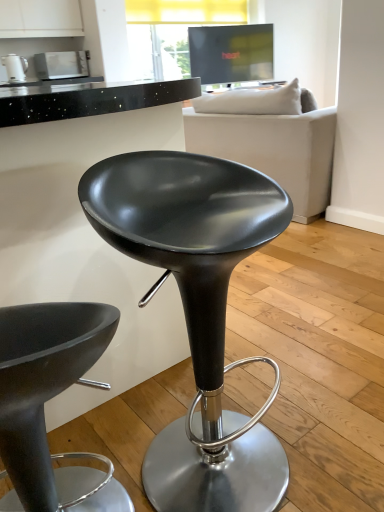
This screenshot has width=384, height=512. Identify the location of matte white kettle at upper left, positioned as the 1th appliance in front-to-back order. (15, 67).

Image resolution: width=384 pixels, height=512 pixels. In order to click on matte white microwave at upper left, the second appliance when ordered from left to right in this screenshot , I will do `click(61, 65)`.

Where is `matte white kettle at upper left, acting as the second appliance starting from the back`? The image size is (384, 512). matte white kettle at upper left, acting as the second appliance starting from the back is located at coordinates 15,67.

From the image's perspective, which object appears higher, white fabric couch at upper center or matte black stool at center, the second chair in the left-to-right sequence?

white fabric couch at upper center.

In the scene shown: What's the angular difference between white fabric couch at upper center and matte black stool at center, placed as the 1th chair when sorted from right to left,'s facing directions?

They differ by 68 degrees in their facing directions.

Does point (282, 118) appear closer or farther from the camera than point (161, 239)?

Point (282, 118) is farther from the camera than point (161, 239).

Is white fabric couch at upper center touching matte black stool at center, placed as the 1th chair when sorted from right to left?

No, white fabric couch at upper center is not next to matte black stool at center, placed as the 1th chair when sorted from right to left.

This screenshot has width=384, height=512. In order to click on chair on the left of the matte black stool at center, placed as the 1th chair when sorted from right to left in this screenshot , I will do `click(49, 399)`.

Who is smaller, matte black stool at center, the second chair in the left-to-right sequence, or matte black stool at center, which is the 2th chair in right-to-left order?

With smaller size is matte black stool at center, which is the 2th chair in right-to-left order.

How different are the orientations of matte black stool at center, the second chair in the left-to-right sequence, and matte black stool at center, the first chair from the left, in degrees?

There is a 110-degree angle between the facing directions of matte black stool at center, the second chair in the left-to-right sequence, and matte black stool at center, the first chair from the left.

Considering the points (173, 443) and (1, 404), which point is behind, point (173, 443) or point (1, 404)?

The point (173, 443) is more distant.

How far apart are matte white microwave at upper left, which ranks as the 1th appliance in right-to-left order, and matte black stool at center, which is the 2th chair in right-to-left order?

matte white microwave at upper left, which ranks as the 1th appliance in right-to-left order, is 4.20 meters away from matte black stool at center, which is the 2th chair in right-to-left order.

How different are the orientations of matte white microwave at upper left, which is the second appliance in front-to-back order, and matte black stool at center, which is the 2th chair in right-to-left order, in degrees?

matte white microwave at upper left, which is the second appliance in front-to-back order, and matte black stool at center, which is the 2th chair in right-to-left order, are facing 134 degrees away from each other.

Is matte white microwave at upper left, the second appliance when ordered from left to right, facing towards matte black stool at center, the first chair from the left?

Yes, matte white microwave at upper left, the second appliance when ordered from left to right, is facing matte black stool at center, the first chair from the left.

From the image's perspective, is matte white microwave at upper left, the first appliance viewed from the back, above or below matte black stool at center, which is the 2th chair in right-to-left order?

From the image's perspective, matte white microwave at upper left, the first appliance viewed from the back, appears above matte black stool at center, which is the 2th chair in right-to-left order.

From the image's perspective, which is above, matte white kettle at upper left, marked as the first appliance in a left-to-right arrangement, or matte white microwave at upper left, which ranks as the 1th appliance in right-to-left order?

matte white microwave at upper left, which ranks as the 1th appliance in right-to-left order, from the image's perspective.

Is matte white kettle at upper left, positioned as the 1th appliance in front-to-back order, in contact with matte white microwave at upper left, the first appliance viewed from the back?

They are not placed beside each other.

Which of these two, matte white kettle at upper left, acting as the second appliance starting from the back, or matte white microwave at upper left, which is the second appliance in front-to-back order, is smaller?

With smaller size is matte white kettle at upper left, acting as the second appliance starting from the back.

Looking at this image, from the image's perspective, who appears lower, matte white kettle at upper left, acting as the second appliance starting from the back, or matte black stool at center, the first chair from the left?

matte black stool at center, the first chair from the left.

From a real-world perspective, is matte white kettle at upper left, which ranks as the 2th appliance in right-to-left order, on matte black stool at center, which is the 2th chair in right-to-left order?

Yes, from a real-world perspective, matte white kettle at upper left, which ranks as the 2th appliance in right-to-left order, is on top of matte black stool at center, which is the 2th chair in right-to-left order.

Considering their positions, is matte white kettle at upper left, positioned as the 1th appliance in front-to-back order, located in front of or behind matte black stool at center, the first chair from the left?

matte white kettle at upper left, positioned as the 1th appliance in front-to-back order, is positioned farther from the viewer than matte black stool at center, the first chair from the left.

How different are the orientations of matte white kettle at upper left, acting as the second appliance starting from the back, and matte black stool at center, which is the 2th chair in right-to-left order, in degrees?

There is a 133-degree angle between the facing directions of matte white kettle at upper left, acting as the second appliance starting from the back, and matte black stool at center, which is the 2th chair in right-to-left order.

Considering the positions of objects matte black stool at center, the first chair from the left, and matte white kettle at upper left, acting as the second appliance starting from the back, in the image provided, who is more to the right, matte black stool at center, the first chair from the left, or matte white kettle at upper left, acting as the second appliance starting from the back,?

matte black stool at center, the first chair from the left.

Does matte black stool at center, the first chair from the left, have a lesser height compared to matte white kettle at upper left, which ranks as the 2th appliance in right-to-left order?

No.

Which point is more forward, (42, 313) or (14, 55)?

Point (42, 313)

Looking at this image, is matte black stool at center, which is the 2th chair in right-to-left order, bigger or smaller than matte white kettle at upper left, which ranks as the 2th appliance in right-to-left order?

In the image, matte black stool at center, which is the 2th chair in right-to-left order, appears to be larger than matte white kettle at upper left, which ranks as the 2th appliance in right-to-left order.

Are matte black stool at center, the second chair in the left-to-right sequence, and white fabric couch at upper center beside each other?

No, matte black stool at center, the second chair in the left-to-right sequence, is not next to white fabric couch at upper center.

How much distance is there between matte black stool at center, placed as the 1th chair when sorted from right to left, and white fabric couch at upper center?

matte black stool at center, placed as the 1th chair when sorted from right to left, and white fabric couch at upper center are 5.74 feet apart from each other.

Is matte black stool at center, the second chair in the left-to-right sequence, not inside white fabric couch at upper center?

Yes, matte black stool at center, the second chair in the left-to-right sequence, is not within white fabric couch at upper center.

Looking at this image, which is farther from the camera, (195,417) or (261,146)?

The point (261,146) is behind.

At what (x,y) coordinates should I click in order to perform the action: click on studio couch above the matte black stool at center, placed as the 1th chair when sorted from right to left (from the image's perspective). Please return your answer as a coordinate pair (x, y). This screenshot has width=384, height=512. Looking at the image, I should click on (273, 150).

The image size is (384, 512). Identify the location of chair that is below the matte black stool at center, the second chair in the left-to-right sequence (from the image's perspective). (49, 399).

From the image, which object appears to be farther from white fabric couch at upper center, matte black stool at center, placed as the 1th chair when sorted from right to left, or matte white kettle at upper left, acting as the second appliance starting from the back?

Among the two, matte white kettle at upper left, acting as the second appliance starting from the back, is located further to white fabric couch at upper center.

Which object lies nearer to the anchor point matte black stool at center, the second chair in the left-to-right sequence, matte white microwave at upper left, the second appliance when ordered from left to right, or matte black stool at center, which is the 2th chair in right-to-left order?

matte black stool at center, which is the 2th chair in right-to-left order, lies closer to matte black stool at center, the second chair in the left-to-right sequence, than the other object.

Based on their spatial positions, is white fabric couch at upper center or matte black stool at center, the first chair from the left, further from matte white microwave at upper left, the second appliance when ordered from left to right?

matte black stool at center, the first chair from the left.

When comparing their distances from matte black stool at center, the second chair in the left-to-right sequence, does white fabric couch at upper center or matte black stool at center, which is the 2th chair in right-to-left order, seem closer?

matte black stool at center, which is the 2th chair in right-to-left order.

Considering their positions, is matte black stool at center, the second chair in the left-to-right sequence, positioned closer to matte black stool at center, the first chair from the left, than matte white microwave at upper left, the first appliance viewed from the back?

matte black stool at center, the second chair in the left-to-right sequence, lies closer to matte black stool at center, the first chair from the left, than the other object.

From the image, which object appears to be farther from matte white microwave at upper left, the second appliance when ordered from left to right, matte black stool at center, the first chair from the left, or white fabric couch at upper center?

matte black stool at center, the first chair from the left, is further to matte white microwave at upper left, the second appliance when ordered from left to right.

When comparing their distances from matte black stool at center, the second chair in the left-to-right sequence, does white fabric couch at upper center or matte white microwave at upper left, the first appliance viewed from the back, seem closer?

white fabric couch at upper center is positioned closer to the anchor matte black stool at center, the second chair in the left-to-right sequence.

When comparing their distances from matte black stool at center, placed as the 1th chair when sorted from right to left, does white fabric couch at upper center or matte white kettle at upper left, which ranks as the 2th appliance in right-to-left order, seem further?

Among the two, matte white kettle at upper left, which ranks as the 2th appliance in right-to-left order, is located further to matte black stool at center, placed as the 1th chair when sorted from right to left.

Where is `studio couch between matte black stool at center, the second chair in the left-to-right sequence, and matte white microwave at upper left, the second appliance when ordered from left to right, along the z-axis`? Image resolution: width=384 pixels, height=512 pixels. studio couch between matte black stool at center, the second chair in the left-to-right sequence, and matte white microwave at upper left, the second appliance when ordered from left to right, along the z-axis is located at coordinates (273, 150).

This screenshot has height=512, width=384. I want to click on chair between matte black stool at center, the first chair from the left, and white fabric couch at upper center from front to back, so click(198, 312).

The width and height of the screenshot is (384, 512). What are the coordinates of `chair between matte black stool at center, the first chair from the left, and matte white kettle at upper left, positioned as the 1th appliance in front-to-back order, in the front-back direction` in the screenshot? It's located at (198, 312).

Where is `studio couch located between matte black stool at center, which is the 2th chair in right-to-left order, and matte white microwave at upper left, which is the second appliance in front-to-back order, in the depth direction`? The image size is (384, 512). studio couch located between matte black stool at center, which is the 2th chair in right-to-left order, and matte white microwave at upper left, which is the second appliance in front-to-back order, in the depth direction is located at coordinates (273, 150).